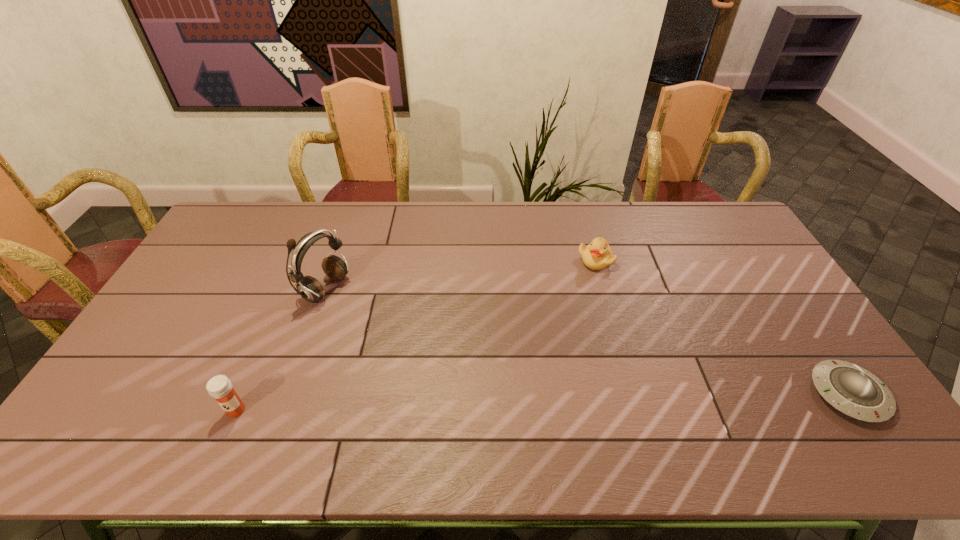
Locate an element on the screen. vacant space located on the ear pads of the earphone is located at coordinates (433, 340).

Where is `free spot located 0.110m on the ear pads of the earphone`? Image resolution: width=960 pixels, height=540 pixels. free spot located 0.110m on the ear pads of the earphone is located at coordinates (372, 312).

Identify the location of blank space located 0.220m on the beak of the third object from left to right. pyautogui.click(x=611, y=323).

Image resolution: width=960 pixels, height=540 pixels. I want to click on vacant space located 0.230m on the beak of the third object from left to right, so click(x=612, y=326).

The image size is (960, 540). What are the coordinates of `vacant space located 0.170m on the beak of the third object from left to right` in the screenshot? It's located at (608, 311).

This screenshot has height=540, width=960. What are the coordinates of `medicine located in the near edge section of the desktop` in the screenshot? It's located at (219, 387).

Image resolution: width=960 pixels, height=540 pixels. Identify the location of saucer that is at the near edge. (856, 392).

Identify the location of object located at the right edge. This screenshot has width=960, height=540. (856, 392).

This screenshot has height=540, width=960. What are the coordinates of `object present at the near right corner` in the screenshot? It's located at (856, 392).

Identify the location of free space at the far edge of the desktop. Image resolution: width=960 pixels, height=540 pixels. (297, 213).